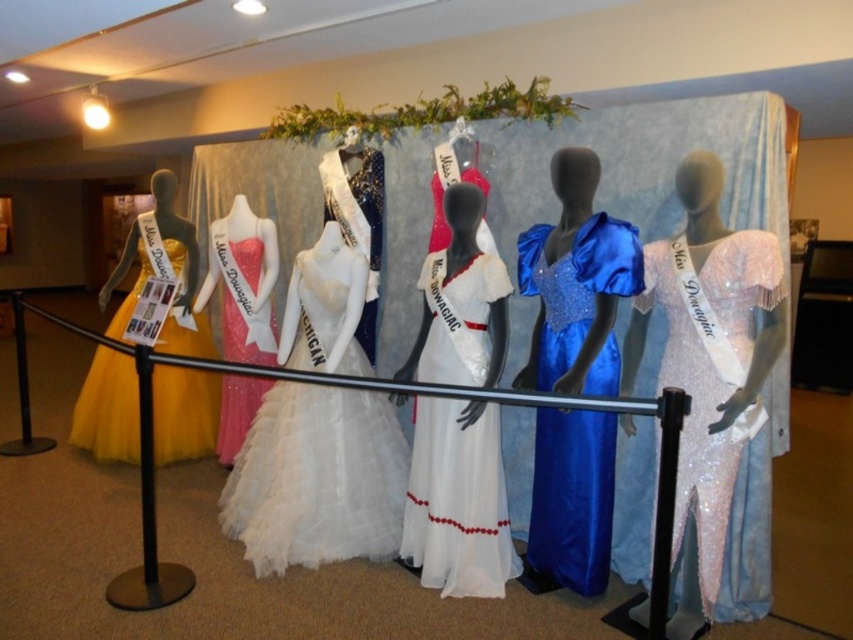
Who is positioned more to the left, matte yellow tulle dress at left or satin white dress at center?

matte yellow tulle dress at left

Looking at this image, can you confirm if matte yellow tulle dress at left is bigger than satin white dress at center?

Yes, matte yellow tulle dress at left is bigger than satin white dress at center.

At what (x,y) coordinates should I click in order to perform the action: click on matte yellow tulle dress at left. Please return your answer as a coordinate pair (x, y). The height and width of the screenshot is (640, 853). Looking at the image, I should click on (108, 408).

Is point (694, 433) positioned in front of point (374, 284)?

Yes, point (694, 433) is in front of point (374, 284).

Identify the location of shiny sequined dress at center. This screenshot has width=853, height=640. (709, 365).

Does point (585, 260) lie behind point (496, 513)?

No, (585, 260) is closer to viewer.

Who is more forward, (555, 257) or (451, 380)?

Point (555, 257) is more forward.

Locate an element on the screen. The width and height of the screenshot is (853, 640). satin blue gown at center is located at coordinates tap(576, 284).